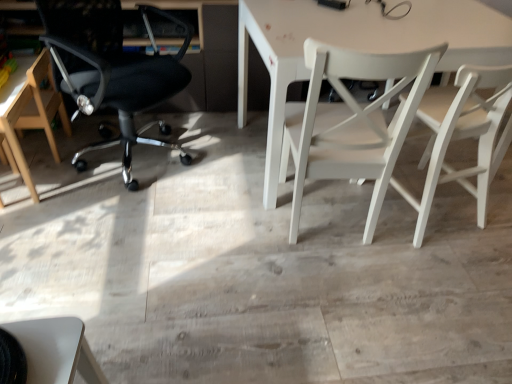
Image resolution: width=512 pixels, height=384 pixels. I want to click on free region under white matte chair at center, the 2th chair from the right (from a real-world perspective), so click(x=331, y=223).